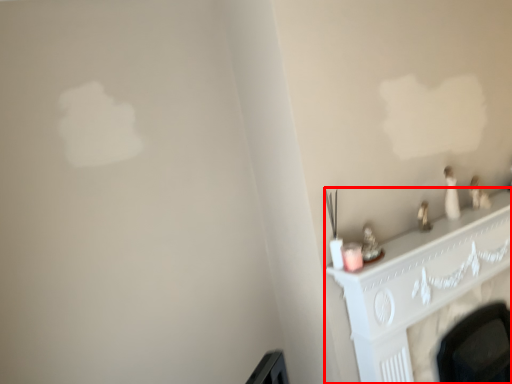
Question: From the image's perspective, what is the correct spatial positioning of fireplace (annotated by the red box) in reference to candle holder?

Choices:
 (A) below
 (B) above

Answer: (A)